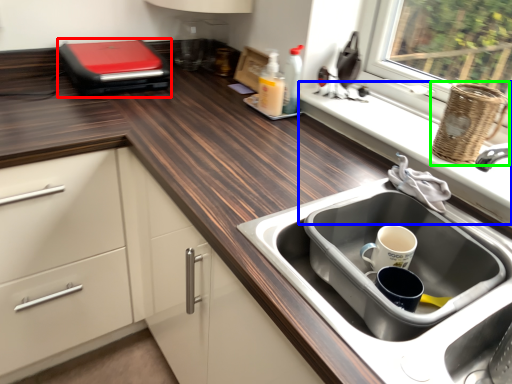
Question: Which object is the closest to the appliance (highlighted by a red box)? Choose among these: window sill (highlighted by a blue box) or basket (highlighted by a green box).

Choices:
 (A) window sill
 (B) basket

Answer: (A)